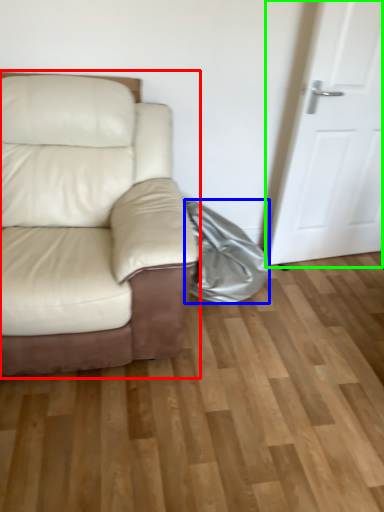
Question: Which object is positioned farthest from studio couch (highlighted by a red box)? Select from material (highlighted by a blue box) and door (highlighted by a green box).

Choices:
 (A) material
 (B) door

Answer: (B)